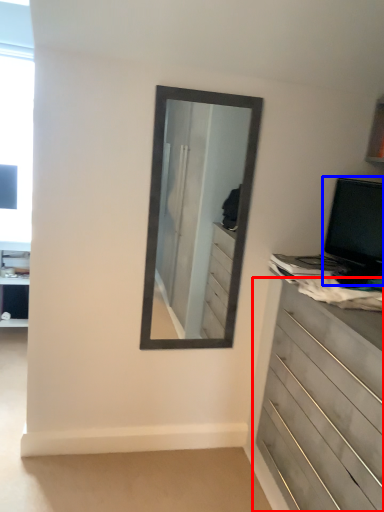
Question: Among these objects, which one is nearest to the camera, chest of drawers (highlighted by a red box) or computer monitor (highlighted by a blue box)?

Choices:
 (A) chest of drawers
 (B) computer monitor

Answer: (A)